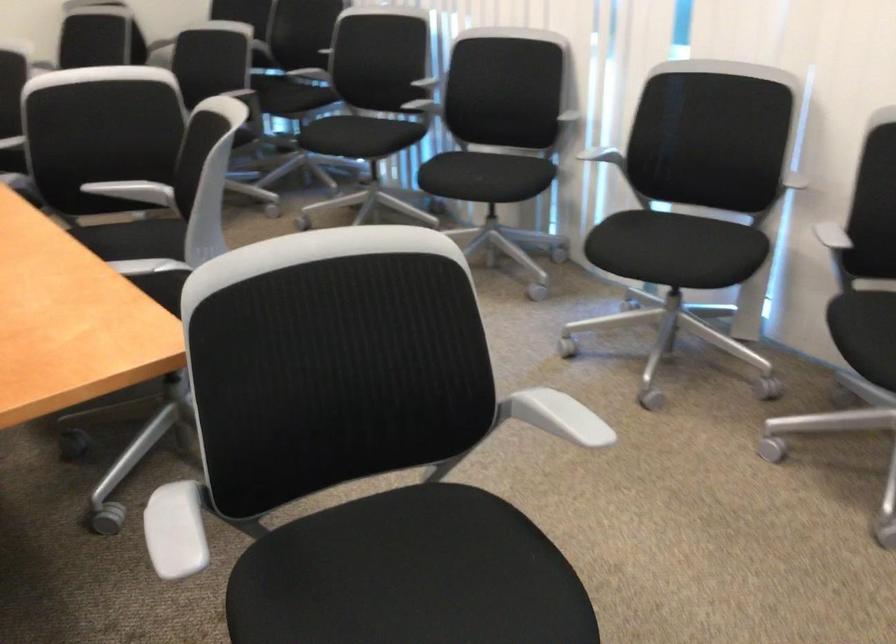
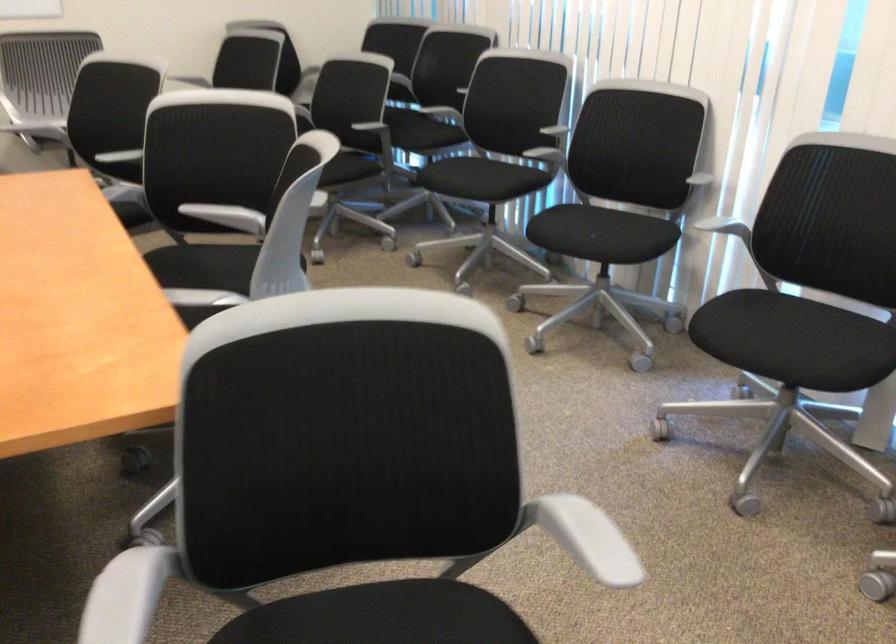
In the second image, find the point that corresponds to point 417,100 in the first image.

(543, 146)